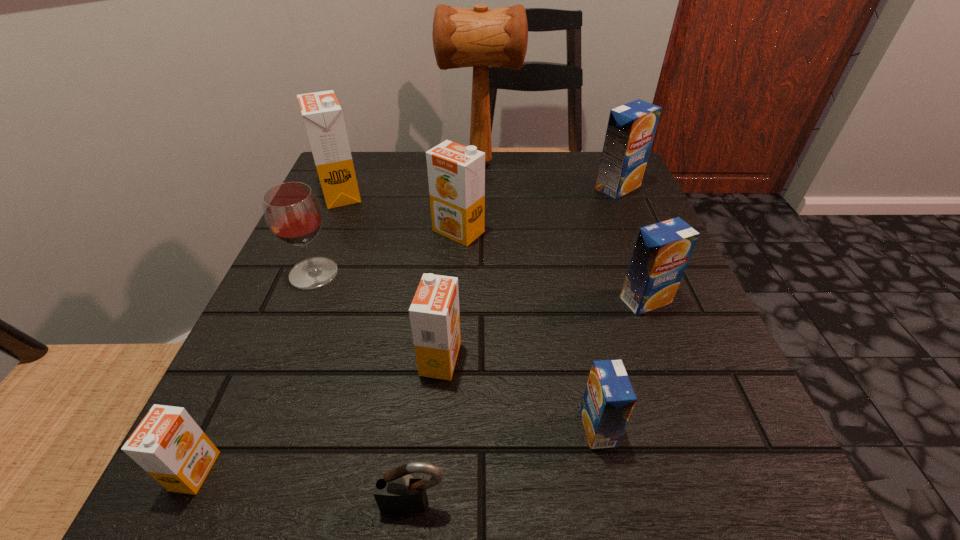
Find the location of `mallet`. mallet is located at coordinates (480, 38).

In order to click on the tallest object in this screenshot , I will do `click(480, 38)`.

Identify the location of the ninth shortest object. (322, 114).

The image size is (960, 540). I want to click on the tallest orange juice, so click(x=322, y=114).

Locate an element on the screen. The height and width of the screenshot is (540, 960). the farthest blue orange_juice is located at coordinates (631, 127).

Locate an element on the screen. Image resolution: width=960 pixels, height=540 pixels. the third farthest orange juice is located at coordinates (456, 173).

Image resolution: width=960 pixels, height=540 pixels. Find the location of `the seventh nearest object`. the seventh nearest object is located at coordinates (456, 173).

You are a GUI agent. You are given a task and a screenshot of the screen. Output one action in this format:
    pyautogui.click(x=<x>, y=<y>)
    Task: Click on the wineglass
    The width and height of the screenshot is (960, 540).
    Given the screenshot: What is the action you would take?
    pyautogui.click(x=292, y=212)

Identify the location of the fourth farthest orange juice. (662, 251).

Locate an element on the screen. This screenshot has width=960, height=540. the second farthest blue orange_juice is located at coordinates (662, 251).